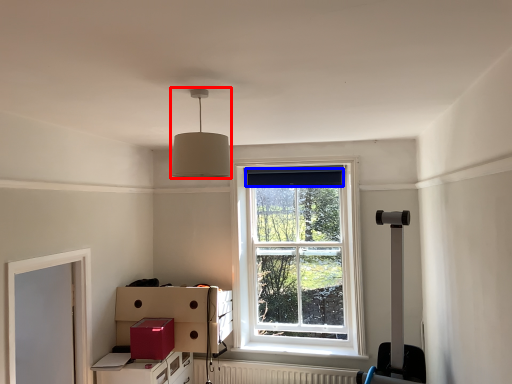
Question: Which object is further to the camera taking this photo, lamp (highlighted by a red box) or curtain (highlighted by a blue box)?

Choices:
 (A) lamp
 (B) curtain

Answer: (B)